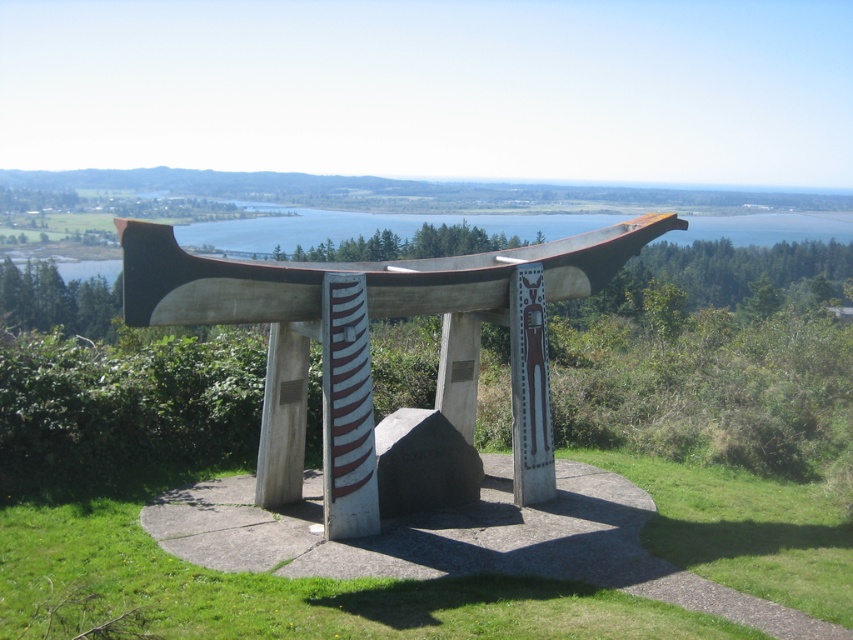
You are standing at the base of the sculpture and want to place a small offering at the point marked as point (299, 589). Based on the description, where exactly is this point located in relation to the sculpture?

The point (299, 589) is on the green grass at center, so you should place the offering on the green grass at center near the sculpture.

You are standing at the base of the sculpture and want to sit down. Which object, the green grass at center or the polished wood bench at center, is nearer to you where you can sit immediately?

The green grass at center is closer to the viewer than the polished wood bench at center, so you can sit on the green grass at center immediately.